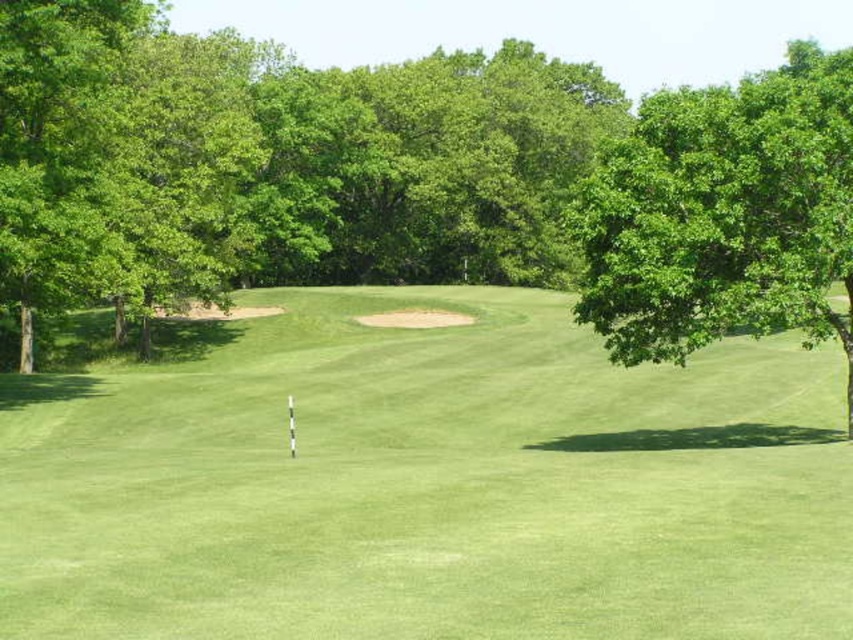
Is point (541, 497) closer to viewer compared to point (786, 148)?

Yes, it is.

From the picture: Which of these two, green grassy golf course at center or green leafy tree at right, stands shorter?

green grassy golf course at center

Is point (778, 353) closer to camera compared to point (697, 109)?

That is False.

Find the location of a particular element. This screenshot has width=853, height=640. green grassy golf course at center is located at coordinates (428, 484).